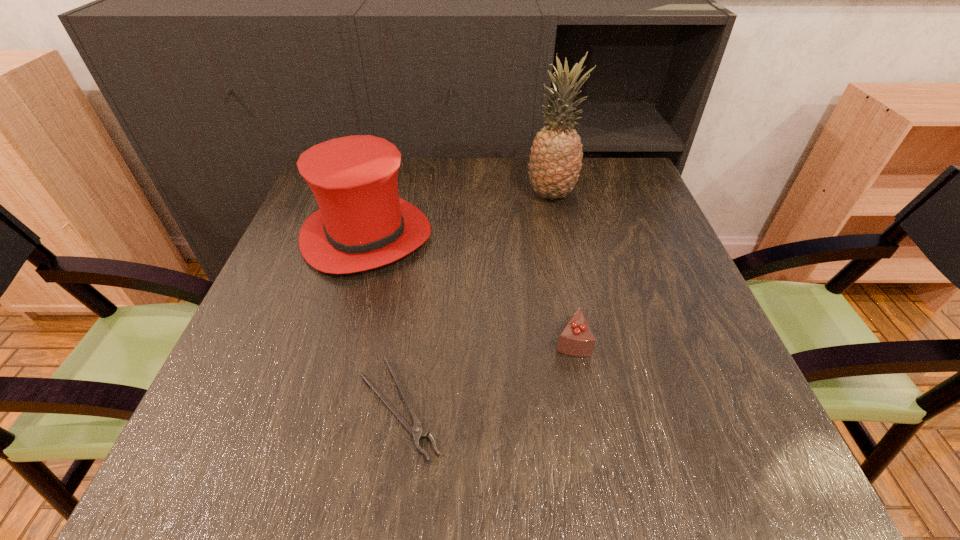
Select which object is the second closest to the third tallest object. Please provide its 2D coordinates. Your answer should be formatted as a tuple, i.e. [(x, y)], where the tuple contains the x and y coordinates of a point satisfying the conditions above.

[(362, 223)]

You are a GUI agent. You are given a task and a screenshot of the screen. Output one action in this format:
    pyautogui.click(x=<x>, y=<y>)
    Task: Click on the object that is the nearest to the pineapple
    This screenshot has height=540, width=960.
    Given the screenshot: What is the action you would take?
    pyautogui.click(x=362, y=223)